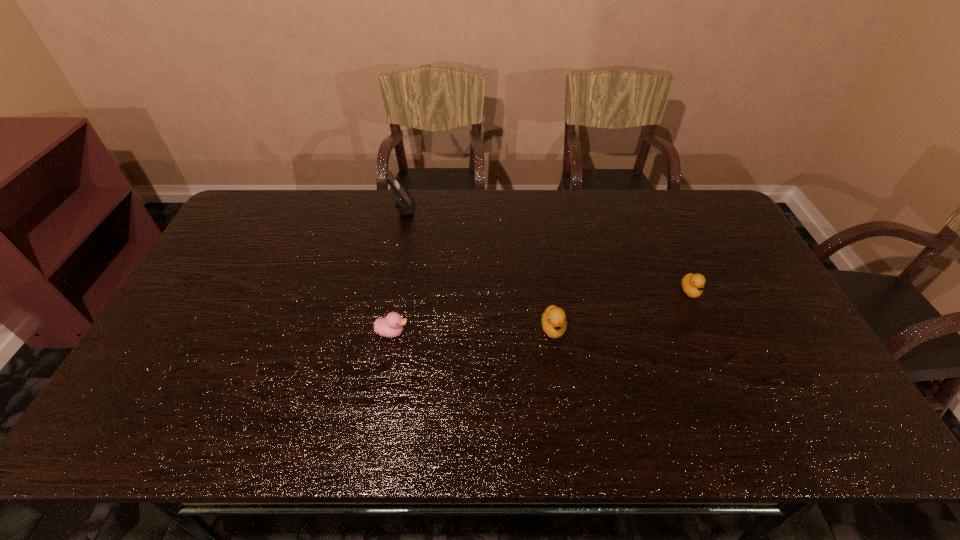
Identify the location of object that is at the far edge. This screenshot has width=960, height=540. (405, 204).

Identify the location of vacant space at the far edge of the desktop. point(445,213).

At what (x,y) coordinates should I click in order to perform the action: click on vacant space at the near edge of the desktop. Please return your answer as a coordinate pair (x, y). Looking at the image, I should click on (729, 423).

Locate an element on the screen. The image size is (960, 540). vacant space at the left edge is located at coordinates (240, 264).

This screenshot has width=960, height=540. Find the location of `vacant area at the right edge`. vacant area at the right edge is located at coordinates (779, 339).

This screenshot has width=960, height=540. In order to click on vacant space at the far left corner in this screenshot , I will do `click(282, 196)`.

This screenshot has height=540, width=960. Identify the location of vacant space that's between the rightmost duckling and the second duckling from right to left. (622, 310).

I want to click on empty space between the leftmost duckling and the farthest object, so click(x=398, y=271).

At what (x,y) coordinates should I click in order to perform the action: click on unoccupied position between the second duckling from right to left and the leftmost duckling. Please return your answer as a coordinate pair (x, y). The height and width of the screenshot is (540, 960). Looking at the image, I should click on coord(473,330).

This screenshot has height=540, width=960. I want to click on empty space between the leftmost duckling and the second duckling from right to left, so click(473, 330).